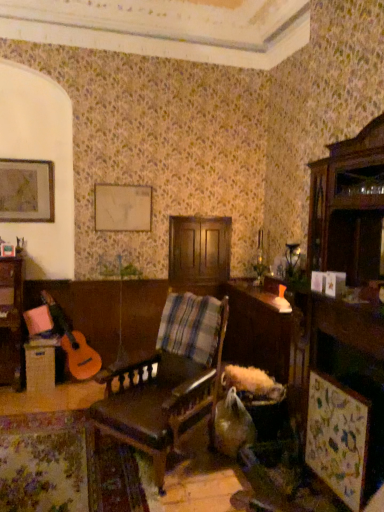
Measure the distance between wooden table at center, arranged as the 2th table when viewed from the left, and camera.

They are 9.99 feet apart.

Image resolution: width=384 pixels, height=512 pixels. What do you see at coordinates (26, 191) in the screenshot?
I see `matte wooden picture frame at upper left` at bounding box center [26, 191].

You are a GUI agent. You are given a task and a screenshot of the screen. Output one action in this format:
    pyautogui.click(x=<x>, y=<y>)
    Task: Click on the wooden table at center, arranged as the 2th table when viewed from the left
    
    Given the screenshot: What is the action you would take?
    pyautogui.click(x=257, y=330)

From the picture: From the image's perspective, does wooden table at center, arranged as the 2th table when viewed from the left, appear lower than matte wooden picture frame at upper left?

Indeed, from the image's perspective, wooden table at center, arranged as the 2th table when viewed from the left, is shown beneath matte wooden picture frame at upper left.

Considering the relative sizes of wooden table at center, the 1th table viewed from the right, and matte wooden picture frame at upper left in the image provided, is wooden table at center, the 1th table viewed from the right, bigger than matte wooden picture frame at upper left?

Yes, wooden table at center, the 1th table viewed from the right, is bigger than matte wooden picture frame at upper left.

Consider the image. Considering the sizes of objects wooden table at center, the 1th table viewed from the right, and matte wooden picture frame at upper left in the image provided, who is taller, wooden table at center, the 1th table viewed from the right, or matte wooden picture frame at upper left?

wooden table at center, the 1th table viewed from the right, is taller.

From a real-world perspective, is wooden table at center, arranged as the 2th table when viewed from the left, over matte wooden picture frame at upper left?

No.

In the scene shown: Is leather-like brown chair at center taller or shorter than matte wooden picture frame at upper left?

Considering their sizes, leather-like brown chair at center has more height than matte wooden picture frame at upper left.

Is leather-like brown chair at center aimed at matte wooden picture frame at upper left?

No, leather-like brown chair at center is not oriented towards matte wooden picture frame at upper left.

From the image's perspective, is leather-like brown chair at center on matte wooden picture frame at upper left?

No, from the image's perspective, leather-like brown chair at center is not on top of matte wooden picture frame at upper left.

In the image, there is a leather-like brown chair at center. Where is `picture frame above it (from the image's perspective)`? The height and width of the screenshot is (512, 384). picture frame above it (from the image's perspective) is located at coordinates (26, 191).

Image resolution: width=384 pixels, height=512 pixels. I want to click on table that is below the wooden table at center, the 1th table viewed from the right (from the image's perspective), so click(40, 365).

Considering the sizes of objects wooden table at center, arranged as the 2th table when viewed from the left, and wooden table at lower left, which ranks as the second table in right-to-left order, in the image provided, who is bigger, wooden table at center, arranged as the 2th table when viewed from the left, or wooden table at lower left, which ranks as the second table in right-to-left order,?

wooden table at center, arranged as the 2th table when viewed from the left.

Would you say wooden table at center, the 1th table viewed from the right, contains wooden table at lower left, which ranks as the second table in right-to-left order?

No, wooden table at lower left, which ranks as the second table in right-to-left order, is not surrounded by wooden table at center, the 1th table viewed from the right.

From their relative heights in the image, would you say wooden table at center, arranged as the 2th table when viewed from the left, is taller or shorter than wooden table at lower left, which ranks as the second table in right-to-left order?

Considering their sizes, wooden table at center, arranged as the 2th table when viewed from the left, has more height than wooden table at lower left, which ranks as the second table in right-to-left order.

Consider the image. Considering the positions of objects wooden table at lower left, which ranks as the second table in right-to-left order, and matte wooden picture frame at upper left in the image provided, who is more to the left, wooden table at lower left, which ranks as the second table in right-to-left order, or matte wooden picture frame at upper left?

From the viewer's perspective, matte wooden picture frame at upper left appears more on the left side.

Looking at this image, between wooden table at lower left, positioned as the 1th table in left-to-right order, and matte wooden picture frame at upper left, which one has larger width?

wooden table at lower left, positioned as the 1th table in left-to-right order, is wider.

From the image's perspective, starting from the matte wooden picture frame at upper left, which table is the 2nd one below? Please provide its 2D coordinates.

[(40, 365)]

Based on the photo, are wooden table at lower left, positioned as the 1th table in left-to-right order, and matte wooden picture frame at upper left making contact?

No, wooden table at lower left, positioned as the 1th table in left-to-right order, is not making contact with matte wooden picture frame at upper left.

Is point (28, 212) behind point (45, 340)?

Yes, point (28, 212) is farther from viewer.

From a real-world perspective, which is physically below, matte wooden picture frame at upper left or wooden table at lower left, positioned as the 1th table in left-to-right order?

wooden table at lower left, positioned as the 1th table in left-to-right order.

Between matte wooden picture frame at upper left and wooden table at lower left, which ranks as the second table in right-to-left order, which one has smaller size?

Smaller between the two is matte wooden picture frame at upper left.

From a real-world perspective, is wooden table at center, arranged as the 2th table when viewed from the left, physically located above or below leather-like brown chair at center?

wooden table at center, arranged as the 2th table when viewed from the left, is below leather-like brown chair at center.

Can you tell me how much wooden table at center, arranged as the 2th table when viewed from the left, and leather-like brown chair at center differ in facing direction?

37.2 degrees.

Considering the points (239, 336) and (104, 402), which point is in front, point (239, 336) or point (104, 402)?

Point (104, 402)

Is wooden table at center, the 1th table viewed from the right, thinner than leather-like brown chair at center?

Correct, the width of wooden table at center, the 1th table viewed from the right, is less than that of leather-like brown chair at center.

Based on the photo, which of these two, matte wooden picture frame at upper left or leather-like brown chair at center, stands shorter?

With less height is matte wooden picture frame at upper left.

Between matte wooden picture frame at upper left and leather-like brown chair at center, which one has smaller size?

matte wooden picture frame at upper left.

Consider the image. Is matte wooden picture frame at upper left outside of leather-like brown chair at center?

Yes, matte wooden picture frame at upper left is not within leather-like brown chair at center.

Considering the positions of points (25, 214) and (212, 406), is point (25, 214) closer to camera compared to point (212, 406)?

No.

Image resolution: width=384 pixels, height=512 pixels. In order to click on the 2nd table in front of the matte wooden picture frame at upper left, starting your count from the anchor in this screenshot , I will do `click(257, 330)`.

Where is `picture frame to the left of leather-like brown chair at center`? The width and height of the screenshot is (384, 512). picture frame to the left of leather-like brown chair at center is located at coordinates (26, 191).

When comparing their distances from wooden table at center, arranged as the 2th table when viewed from the left, does leather-like brown chair at center or wooden table at lower left, which ranks as the second table in right-to-left order, seem closer?

leather-like brown chair at center.

Which object lies nearer to the anchor point matte wooden picture frame at upper left, wooden table at lower left, positioned as the 1th table in left-to-right order, or leather-like brown chair at center?

wooden table at lower left, positioned as the 1th table in left-to-right order, lies closer to matte wooden picture frame at upper left than the other object.

From the image, which object appears to be farther from wooden table at center, the 1th table viewed from the right, wooden table at lower left, which ranks as the second table in right-to-left order, or matte wooden picture frame at upper left?

Based on the image, matte wooden picture frame at upper left appears to be further to wooden table at center, the 1th table viewed from the right.

From the image, which object appears to be nearer to wooden table at center, the 1th table viewed from the right, matte wooden picture frame at upper left or leather-like brown chair at center?

leather-like brown chair at center is closer to wooden table at center, the 1th table viewed from the right.

Which object lies nearer to the anchor point leather-like brown chair at center, matte wooden picture frame at upper left or wooden table at lower left, positioned as the 1th table in left-to-right order?

The object closer to leather-like brown chair at center is wooden table at lower left, positioned as the 1th table in left-to-right order.

Consider the image. Which object lies further to the anchor point leather-like brown chair at center, matte wooden picture frame at upper left or wooden table at center, the 1th table viewed from the right?

Based on the image, matte wooden picture frame at upper left appears to be further to leather-like brown chair at center.

Based on their spatial positions, is matte wooden picture frame at upper left or leather-like brown chair at center further from wooden table at lower left, positioned as the 1th table in left-to-right order?

Among the two, leather-like brown chair at center is located further to wooden table at lower left, positioned as the 1th table in left-to-right order.

When comparing their distances from leather-like brown chair at center, does wooden table at center, arranged as the 2th table when viewed from the left, or matte wooden picture frame at upper left seem closer?

wooden table at center, arranged as the 2th table when viewed from the left, lies closer to leather-like brown chair at center than the other object.

You are a GUI agent. You are given a task and a screenshot of the screen. Output one action in this format:
    pyautogui.click(x=<x>, y=<y>)
    Task: Click on the chair situated between matte wooden picture frame at upper left and wooden table at center, arranged as the 2th table when viewed from the left, from left to right
    
    Given the screenshot: What is the action you would take?
    pyautogui.click(x=161, y=400)

What are the coordinates of `chair situated between wooden table at lower left, positioned as the 1th table in left-to-right order, and wooden table at center, arranged as the 2th table when viewed from the left, from left to right` in the screenshot? It's located at (161, 400).

Where is `table located between matte wooden picture frame at upper left and wooden table at center, the 1th table viewed from the right, in the left-right direction`? The image size is (384, 512). table located between matte wooden picture frame at upper left and wooden table at center, the 1th table viewed from the right, in the left-right direction is located at coordinates tap(40, 365).